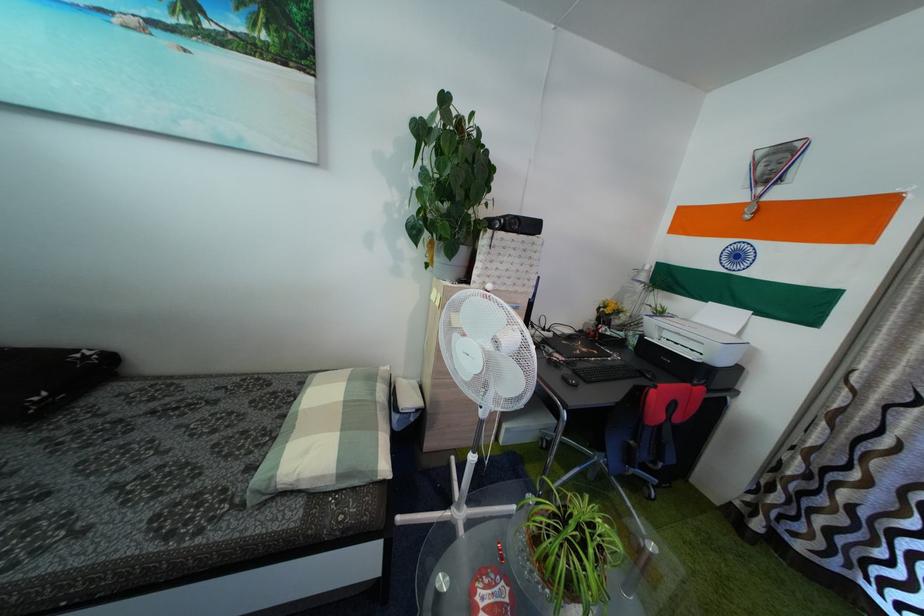
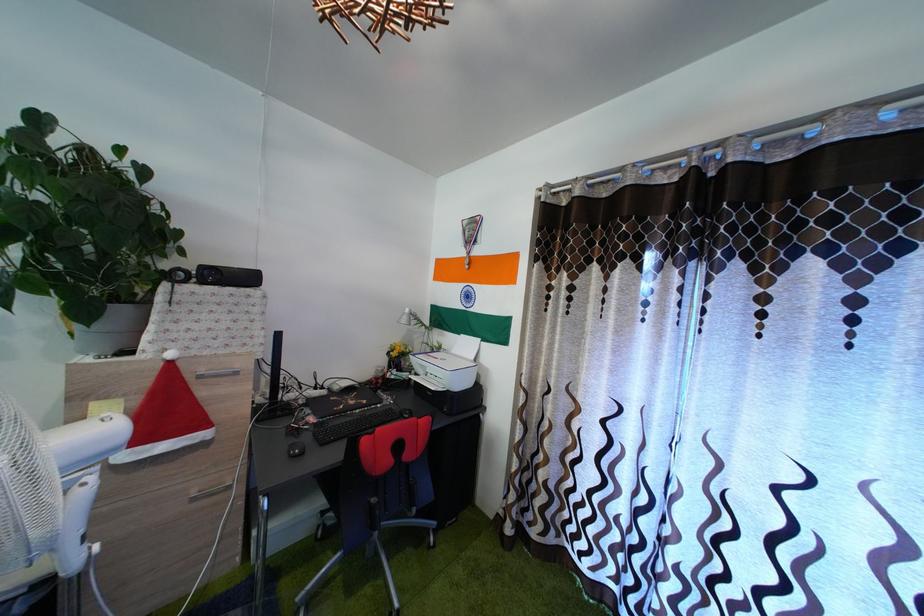
Where in the second image is the point corresponding to point 703,328 from the first image?

(462, 359)